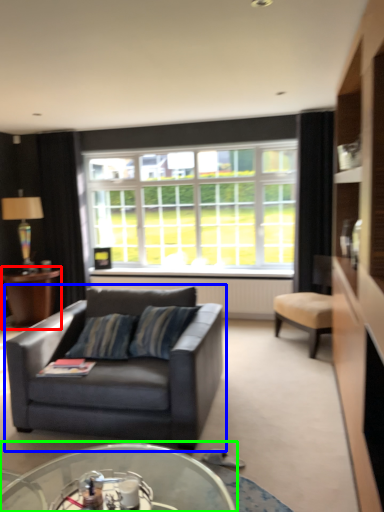
Question: Which object is the farthest from table (highlighted by a red box)? Choose among these: studio couch (highlighted by a blue box) or coffee table (highlighted by a green box).

Choices:
 (A) studio couch
 (B) coffee table

Answer: (B)